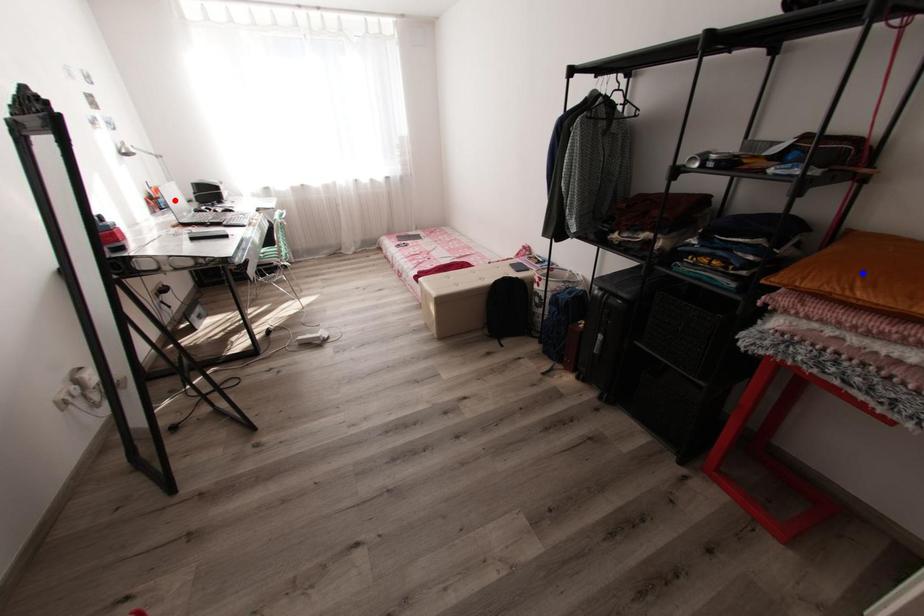
Question: Two points are marked on the image. Which point is closer to the camera?

Choices:
 (A) Blue point is closer.
 (B) Red point is closer.

Answer: (A)